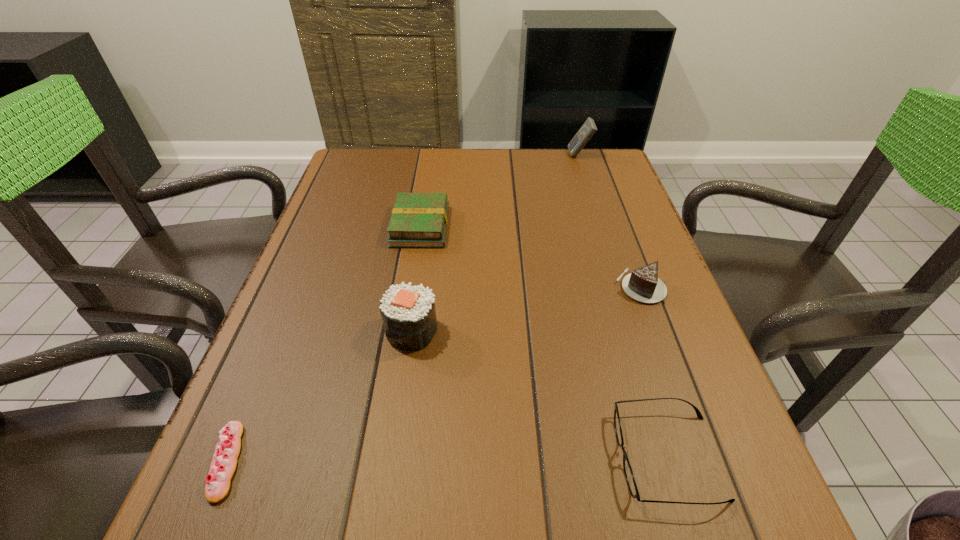
I want to click on free location located on the front-facing side of the tallest object, so click(491, 155).

At what (x,y) coordinates should I click in order to perform the action: click on free space located on the front-facing side of the tallest object. Please return your answer as a coordinate pair (x, y). Image resolution: width=960 pixels, height=540 pixels. Looking at the image, I should click on (484, 155).

The height and width of the screenshot is (540, 960). Identify the location of free space located 0.330m on the front-facing side of the tallest object. (466, 155).

At what (x,y) coordinates should I click in order to perform the action: click on blank area located on the back of the fourth farthest object. Please return your answer as a coordinate pair (x, y). Looking at the image, I should click on (428, 217).

Identify the location of free space located on the left of the fourth nearest object. (x=554, y=287).

I want to click on vacant space located 0.260m on the back of the third shortest object, so click(431, 159).

The height and width of the screenshot is (540, 960). I want to click on free space located on the front-facing side of the second shortest object, so click(x=437, y=457).

In order to click on vacant space located on the front-facing side of the second shortest object in this screenshot , I will do `click(512, 457)`.

Image resolution: width=960 pixels, height=540 pixels. Identify the location of blank space located 0.140m on the front-facing side of the second shortest object. (530, 457).

Where is `vacant space situated on the back of the eclair`? vacant space situated on the back of the eclair is located at coordinates (259, 382).